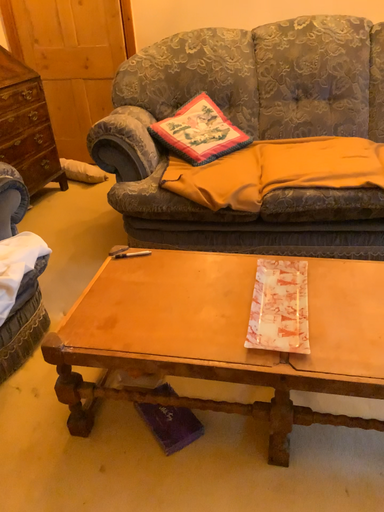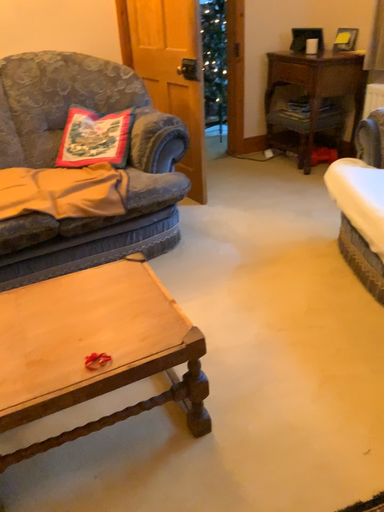
Question: Which way did the camera rotate in the video?

Choices:
 (A) rotated left
 (B) rotated right

Answer: (B)